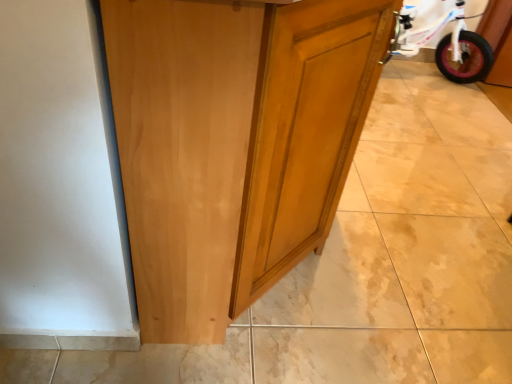
Locate an element on the screen. unoccupied region to the right of glossy wood cupboard at center is located at coordinates (407, 307).